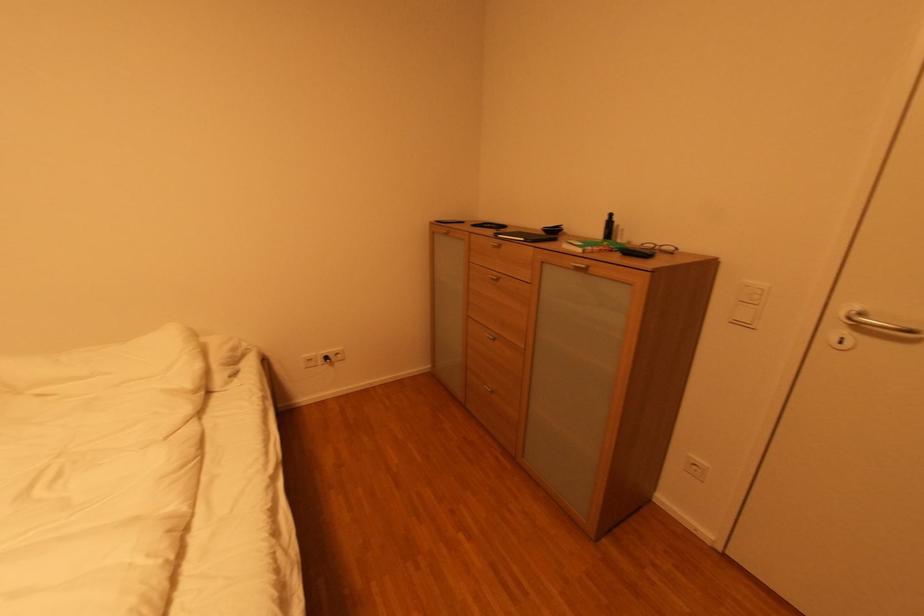
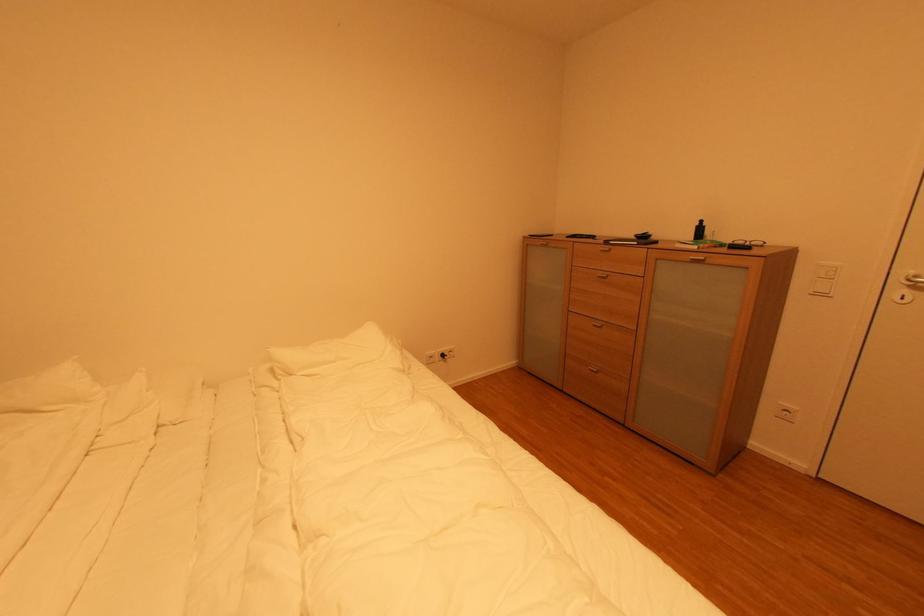
In a continuous first-person perspective shot, in which direction is the camera moving?

The movement direction of the cameraman is left, backward.